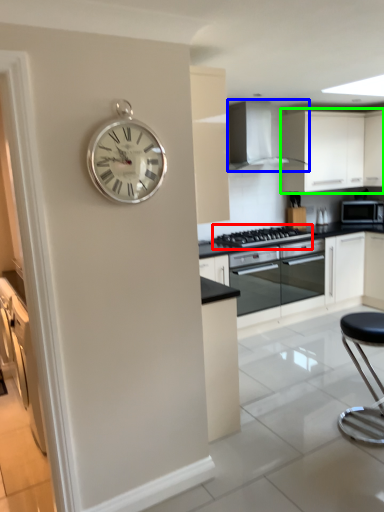
Question: Which object is positioned farthest from gas stove (highlighted by a red box)? Select from home appliance (highlighted by a blue box) and cabinetry (highlighted by a green box).

Choices:
 (A) home appliance
 (B) cabinetry

Answer: (B)